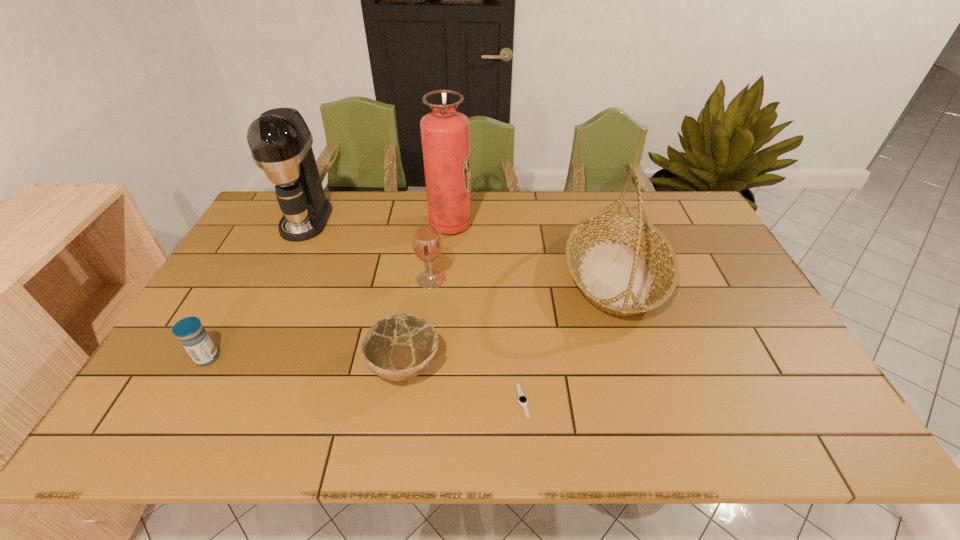
Find the location of a particular element. The height and width of the screenshot is (540, 960). vacant space that satisfies the following two spatial constraints: 1. on the back side of the fifth tallest object; 2. on the left side of the fourth tallest object is located at coordinates click(x=251, y=279).

Locate an element on the screen. The width and height of the screenshot is (960, 540). free space in the image that satisfies the following two spatial constraints: 1. place cup under the spout of the coffee maker; 2. on the right side of the sixth object from left to right is located at coordinates (218, 401).